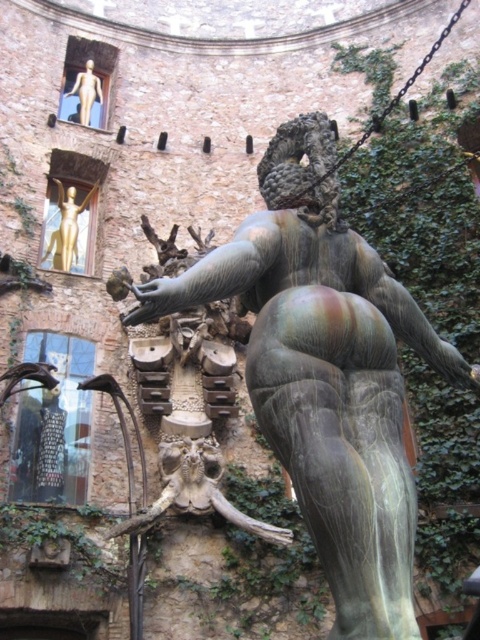
Question: Among these points, which one is nearest to the camera?

Choices:
 (A) (82, 113)
 (B) (69, 243)
 (C) (317, 387)

Answer: (C)

Question: Which is nearer to the matte gold statue at upper left?

Choices:
 (A) bronze statue at center
 (B) gold metallic statue at upper left

Answer: (B)

Question: Can you confirm if gold metallic statue at upper left is positioned to the left of matte gold statue at upper left?

Choices:
 (A) yes
 (B) no

Answer: (B)

Question: Can you confirm if bronze statue at center is positioned below matte gold statue at upper left?

Choices:
 (A) yes
 (B) no

Answer: (A)

Question: Observing the image, what is the correct spatial positioning of bronze statue at center in reference to gold metallic statue at upper left?

Choices:
 (A) left
 (B) right

Answer: (B)

Question: Among these points, which one is nearest to the camera?

Choices:
 (A) (394, 448)
 (B) (79, 253)
 (C) (100, 93)

Answer: (A)